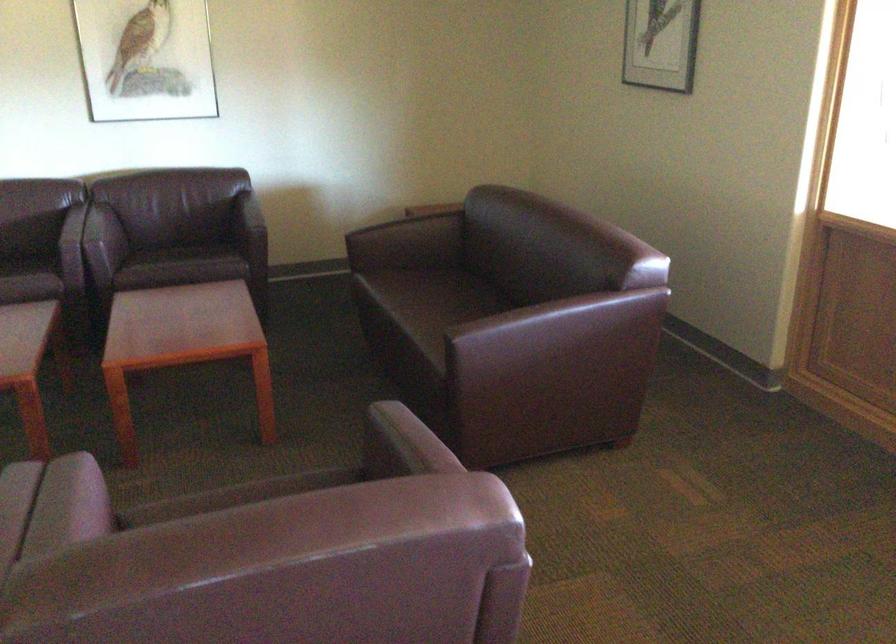
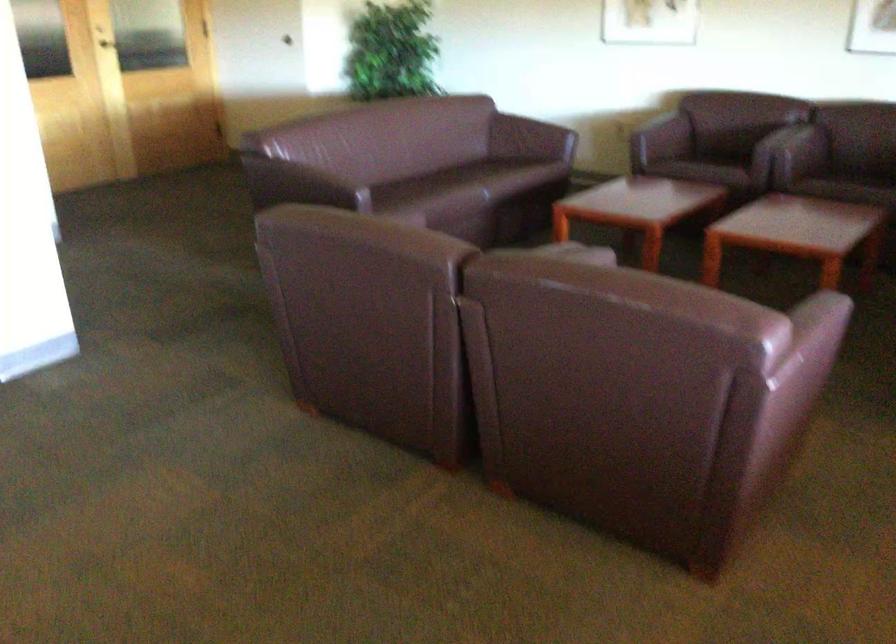
Locate, in the second image, the point that corresponds to pixel 405 460 in the first image.

(821, 325)